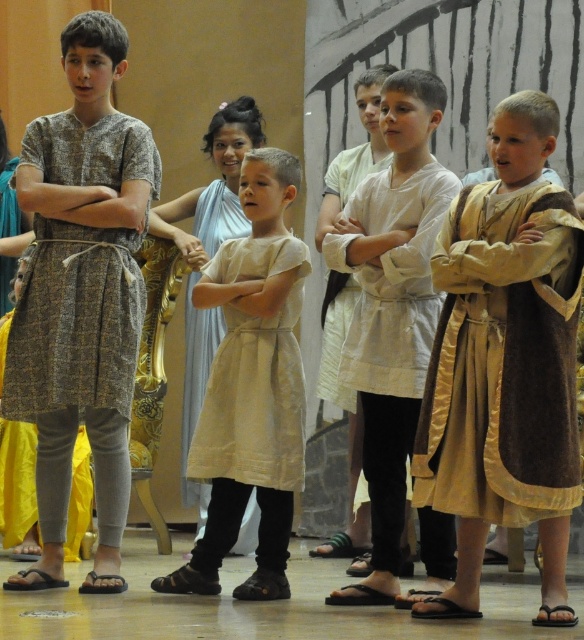
Question: Is textured brown tunic at center thinner than beige linen dress at center?

Choices:
 (A) no
 (B) yes

Answer: (A)

Question: Can you confirm if textured brown tunic at center is positioned above beige linen dress at center?

Choices:
 (A) yes
 (B) no

Answer: (A)

Question: Is textured brown tunic at center bigger than beige fabric dress at center?

Choices:
 (A) yes
 (B) no

Answer: (A)

Question: Which object is the closest to the light beige fabric robe at center?

Choices:
 (A) beige cotton dress at center
 (B) beige fabric dress at center
 (C) gold satin robe at right
 (D) textured brown tunic at center

Answer: (D)

Question: Among these objects, which one is farthest from the camera?

Choices:
 (A) beige cotton dress at center
 (B) light beige fabric robe at center
 (C) gold satin robe at right
 (D) white cotton tunic at center

Answer: (A)

Question: Which is nearer to the textured brown tunic at center?

Choices:
 (A) gold satin robe at right
 (B) beige fabric dress at center

Answer: (B)